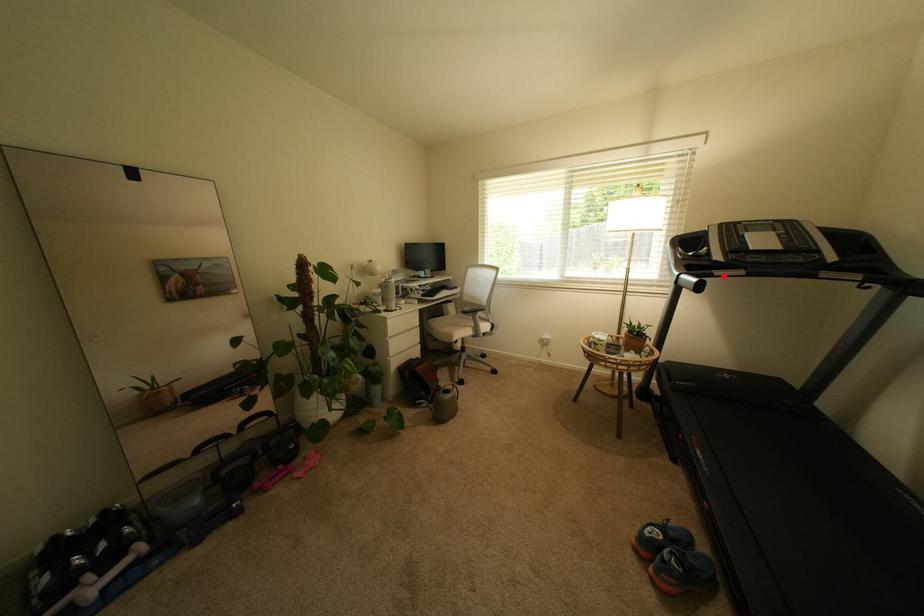
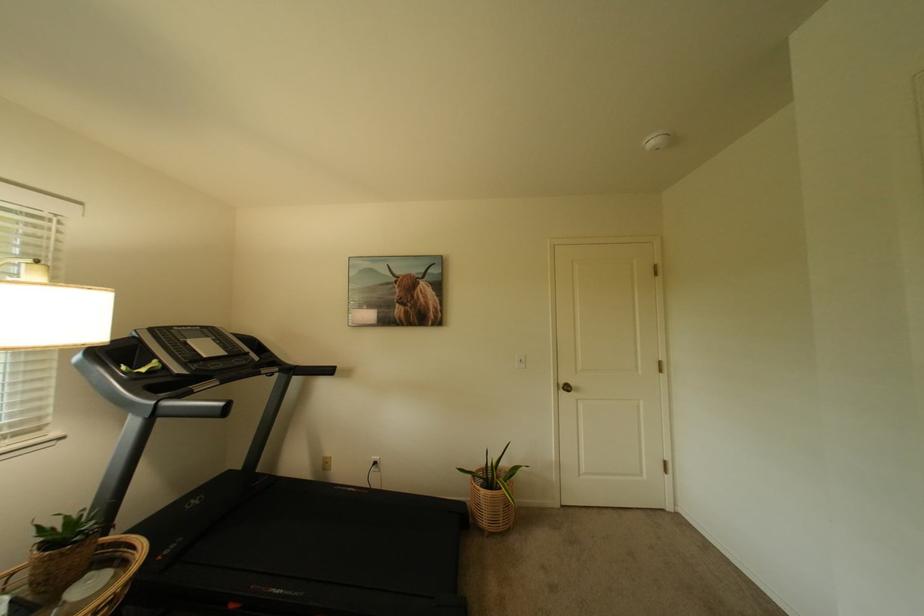
In the second image, find the point that corresponds to the highlighted location in the first image.

(203, 392)